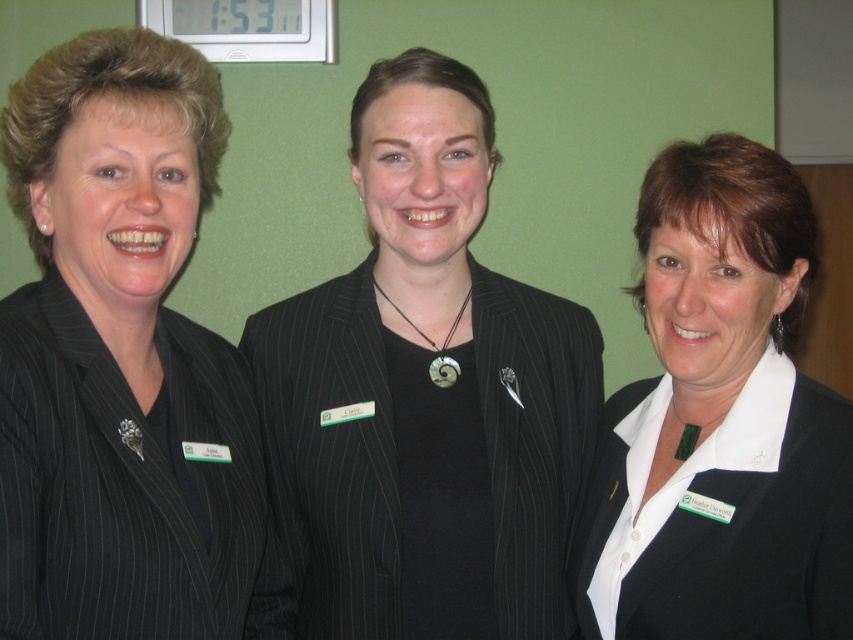
You are standing at the point marked as point (x=73, y=120) and want to take a photo of the three women in the scene. Since you are 37.14 inches away from the women, will you be able to capture all three of them in a single frame without moving your camera?

Yes, you can capture all three women in a single frame because you are 37.14 inches away from them, which is a suitable distance to include all three in the camera view.

You are a photographer standing at a certain distance from the women. You want to take a closeup shot of the white matte blazer at center without moving the camera. Is the current distance sufficient to capture the blazer clearly in the photo?

The distance between the white matte blazer at center and the camera is 37.43 inches. Whether this is sufficient depends on the camera lens and sensor capabilities, but generally, 37.43 inches is a common comfortable distance for clear closeup shots of clothing items like blazers.

You are an event planner organizing a photoshoot and need to arrange the matte black suit at left and the black pinstripe suit at center based on their sizes. Which suit should be placed first if you want to arrange them from tallest to shortest?

The matte black suit at left has a greater height compared to the black pinstripe suit at center, so you should place the matte black suit at left first when arranging from tallest to shortest.